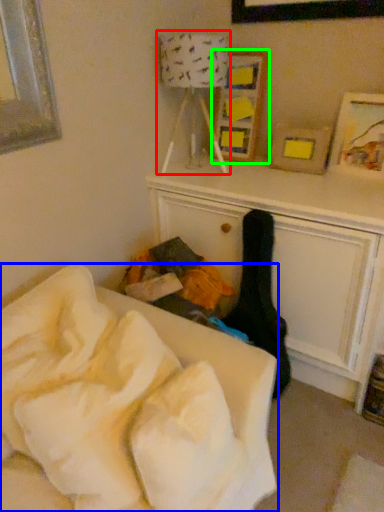
Question: Based on their relative distances, which object is nearer to lamp (highlighted by a red box)? Choose from furniture (highlighted by a blue box) and picture frame (highlighted by a green box).

Choices:
 (A) furniture
 (B) picture frame

Answer: (B)